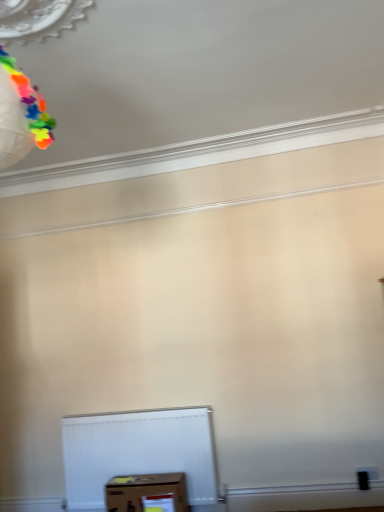
Question: Is brown cardboard box at lower center facing away from multicolored paper at upper left?

Choices:
 (A) no
 (B) yes

Answer: (A)

Question: Is brown cardboard box at lower center bigger than multicolored paper at upper left?

Choices:
 (A) yes
 (B) no

Answer: (A)

Question: Is brown cardboard box at lower center closer to the viewer compared to multicolored paper at upper left?

Choices:
 (A) yes
 (B) no

Answer: (B)

Question: Would you say brown cardboard box at lower center is a long distance from multicolored paper at upper left?

Choices:
 (A) yes
 (B) no

Answer: (A)

Question: From the image's perspective, would you say brown cardboard box at lower center is positioned over multicolored paper at upper left?

Choices:
 (A) no
 (B) yes

Answer: (A)

Question: Can you confirm if brown cardboard box at lower center is shorter than multicolored paper at upper left?

Choices:
 (A) yes
 (B) no

Answer: (A)

Question: Is the depth of multicolored paper at upper left less than that of brown cardboard box at lower center?

Choices:
 (A) yes
 (B) no

Answer: (A)

Question: Does multicolored paper at upper left have a larger size compared to brown cardboard box at lower center?

Choices:
 (A) yes
 (B) no

Answer: (B)

Question: Is multicolored paper at upper left taller than brown cardboard box at lower center?

Choices:
 (A) yes
 (B) no

Answer: (A)

Question: Is multicolored paper at upper left touching brown cardboard box at lower center?

Choices:
 (A) yes
 (B) no

Answer: (B)

Question: Could you tell me if multicolored paper at upper left is turned towards brown cardboard box at lower center?

Choices:
 (A) no
 (B) yes

Answer: (A)

Question: From the image's perspective, is multicolored paper at upper left on brown cardboard box at lower center?

Choices:
 (A) yes
 (B) no

Answer: (A)

Question: From the image's perspective, is multicolored paper at upper left located above or below brown cardboard box at lower center?

Choices:
 (A) below
 (B) above

Answer: (B)